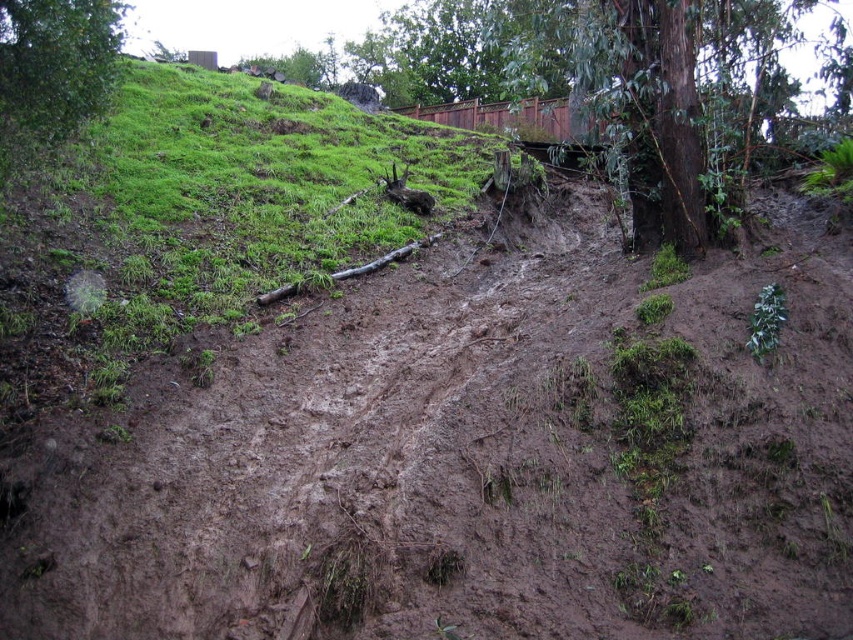
Does point (614, 397) come farther from viewer compared to point (177, 99)?

No, (614, 397) is in front of (177, 99).

Image resolution: width=853 pixels, height=640 pixels. What do you see at coordinates (469, 460) in the screenshot?
I see `brown muddy dirt track at center` at bounding box center [469, 460].

Which is behind, point (703, 340) or point (212, 122)?

The point (212, 122) is behind.

Image resolution: width=853 pixels, height=640 pixels. What are the coordinates of `brown muddy dirt track at center` in the screenshot? It's located at (469, 460).

Is brown muddy dirt track at center shorter than green leafy tree at upper left?

Yes.

Between brown muddy dirt track at center and green leafy tree at upper left, which one has less height?

With less height is brown muddy dirt track at center.

Between point (213, 547) and point (42, 124), which one is positioned in front?

Point (213, 547) is in front.

This screenshot has width=853, height=640. Find the location of `brown muddy dirt track at center`. brown muddy dirt track at center is located at coordinates (469, 460).

Who is positioned more to the left, green grassy at upper left or green leafy tree at upper left?

Positioned to the left is green leafy tree at upper left.

Does green grassy at upper left appear on the right side of green leafy tree at upper left?

Indeed, green grassy at upper left is positioned on the right side of green leafy tree at upper left.

Image resolution: width=853 pixels, height=640 pixels. What do you see at coordinates (202, 216) in the screenshot? I see `green grassy at upper left` at bounding box center [202, 216].

Locate an element on the screen. green grassy at upper left is located at coordinates (202, 216).